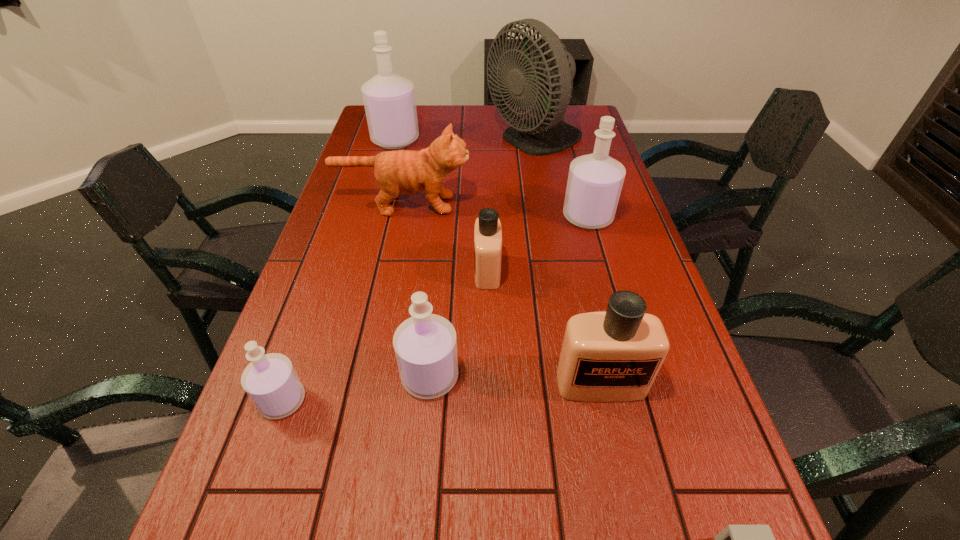
This screenshot has height=540, width=960. In order to click on free space located 0.150m on the front label of the bigger beige perfume in this screenshot , I will do `click(623, 483)`.

Find the location of a particular element. The height and width of the screenshot is (540, 960). blank space located 0.140m on the front label of the smaller beige perfume is located at coordinates (419, 271).

At what (x,y) coordinates should I click in order to perform the action: click on vacant region located on the front label of the smaller beige perfume. Please return your answer as a coordinate pair (x, y). This screenshot has width=960, height=540. Looking at the image, I should click on click(336, 271).

Find the location of `vacant space located 0.300m on the front label of the smaller beige perfume`. vacant space located 0.300m on the front label of the smaller beige perfume is located at coordinates (356, 271).

The image size is (960, 540). Find the location of `vacant point located 0.150m on the right of the smallest purple perfume`. vacant point located 0.150m on the right of the smallest purple perfume is located at coordinates (382, 401).

Image resolution: width=960 pixels, height=540 pixels. I want to click on fan at the far edge, so click(x=541, y=73).

You are a GUI agent. You are given a task and a screenshot of the screen. Output one action in this format:
    pyautogui.click(x=<x>, y=<y>)
    Task: Click on the perfume that is at the far edge
    
    Given the screenshot: What is the action you would take?
    pyautogui.click(x=389, y=99)

Identify the location of cat situated at the left edge. (404, 172).

Where is `fan located in the right edge section of the desktop`? fan located in the right edge section of the desktop is located at coordinates (541, 73).

Identify the location of object that is at the far left corner. Image resolution: width=960 pixels, height=540 pixels. (389, 99).